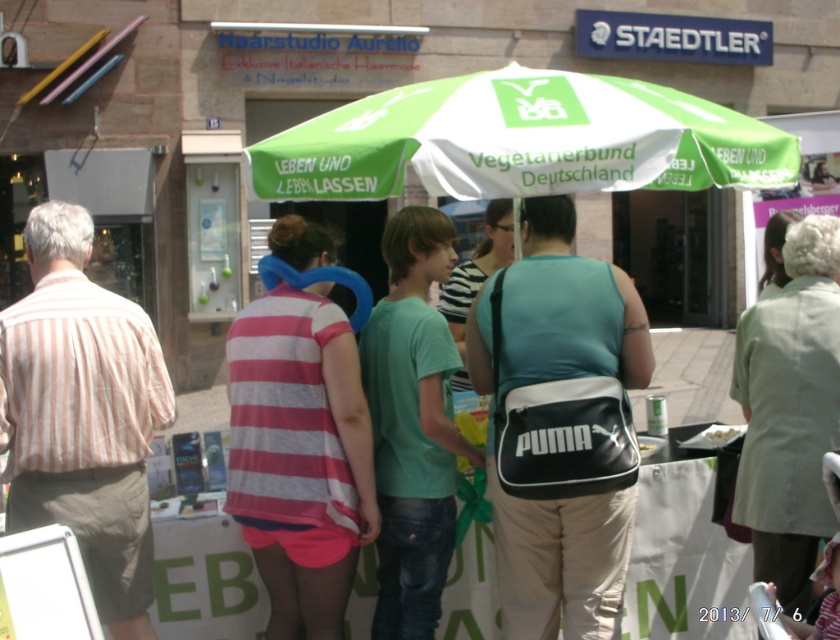
Question: Is green fabric umbrella at center bigger than black synthetic bag at center?

Choices:
 (A) no
 (B) yes

Answer: (B)

Question: Is green fabric umbrella at center below white crumbly food at center?

Choices:
 (A) yes
 (B) no

Answer: (B)

Question: Which point is farther to the camera?

Choices:
 (A) (664, 186)
 (B) (56, 260)

Answer: (A)

Question: Does green fabric umbrella at center have a lesser width compared to white crumbly food at center?

Choices:
 (A) no
 (B) yes

Answer: (A)

Question: Which object appears farthest from the camera in this image?

Choices:
 (A) striped cotton shirt at left
 (B) green fabric umbrella at center

Answer: (B)

Question: Which object is farther from the camera taking this photo?

Choices:
 (A) green fabric umbrella at center
 (B) white crumbly food at center
 (C) striped cotton shirt at left
 (D) black synthetic bag at center

Answer: (B)